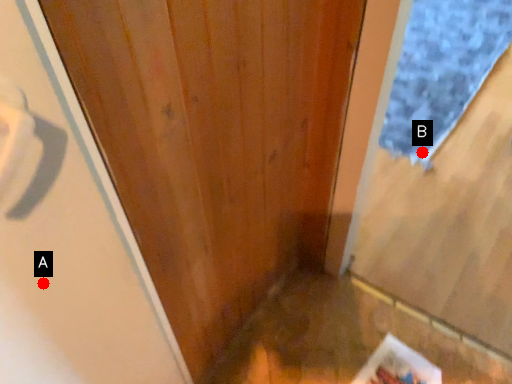
Question: Two points are circled on the image, labeled by A and B beside each circle. Which point is closer to the camera?

Choices:
 (A) A is closer
 (B) B is closer

Answer: (A)